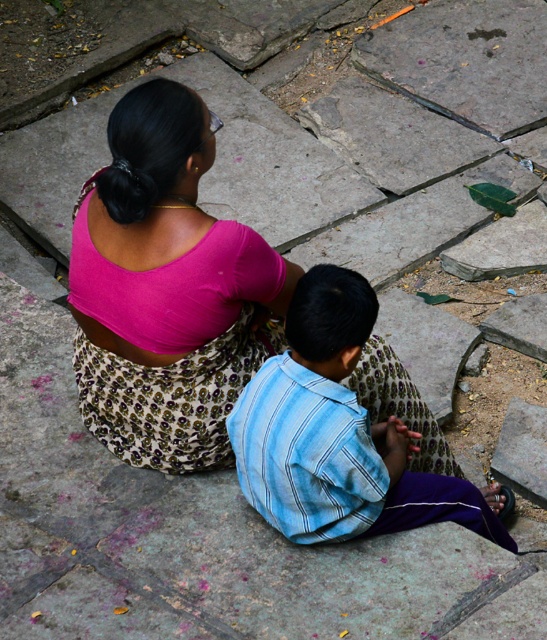
Is point (154, 228) positioned behind point (295, 413)?

Yes, point (154, 228) is behind point (295, 413).

Is point (392, 404) positioned before point (276, 368)?

That is False.

You are a GUI agent. You are given a task and a screenshot of the screen. Output one action in this format:
    pyautogui.click(x=<x>, y=<y>)
    Task: Click on the pink fabric at center
    Image resolution: width=547 pixels, height=640 pixels.
    Given the screenshot: What is the action you would take?
    pyautogui.click(x=166, y=292)